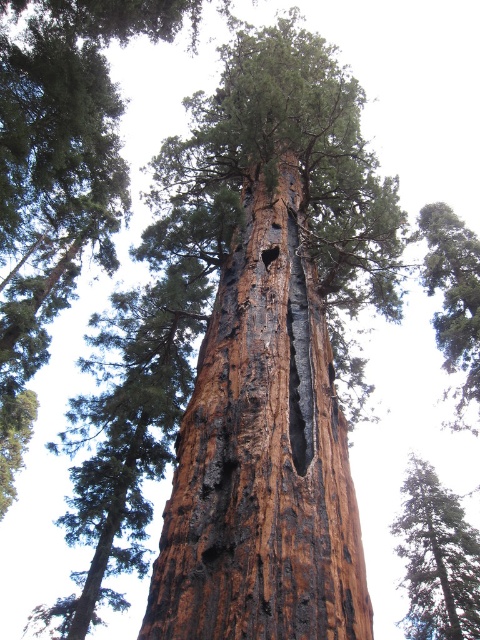
The width and height of the screenshot is (480, 640). In order to click on rough bark tree at center in this screenshot , I will do `click(436, 557)`.

Identify the location of rough bark tree at center. This screenshot has height=640, width=480. (436, 557).

Who is more forward, (267, 435) or (271, 248)?

Positioned in front is point (267, 435).

Locate an element on the screen. charred bark tree trunk at center is located at coordinates (263, 456).

Does charred bark tree trunk at center have a greater height compared to rough bark tree at center?

No.

Does point (291, 593) lie behind point (399, 524)?

No.

This screenshot has width=480, height=640. Identify the location of charred bark tree trunk at center. (263, 456).